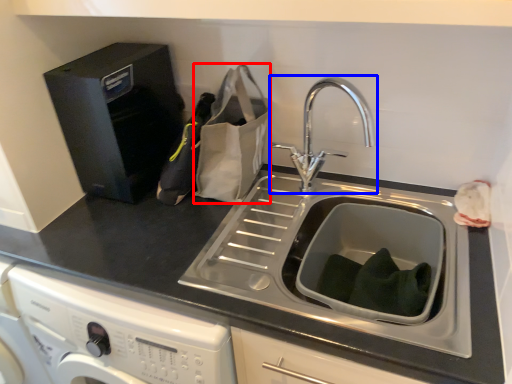
Question: Among these objects, which one is farthest to the camera, paper bag (highlighted by a red box) or tap (highlighted by a blue box)?

Choices:
 (A) paper bag
 (B) tap

Answer: (A)